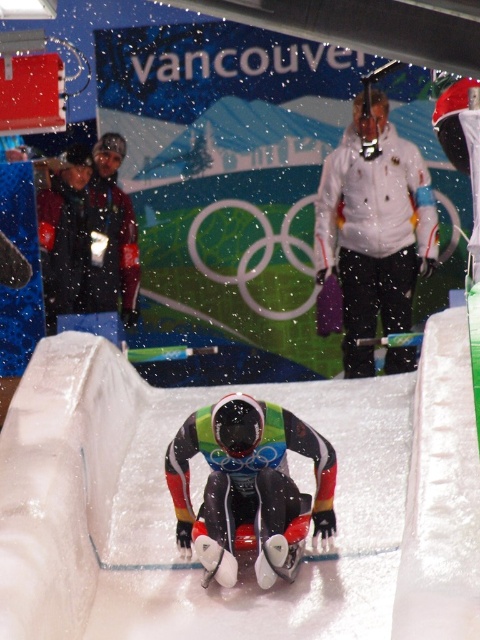
Between white matte jacket at upper center and multicolored glossy suit at center, which one appears on the right side from the viewer's perspective?

Positioned to the right is white matte jacket at upper center.

Between point (387, 214) and point (191, 529), which one is positioned in front?

Point (191, 529) is in front.

What are the coordinates of `white matte jacket at upper center` in the screenshot? It's located at (373, 228).